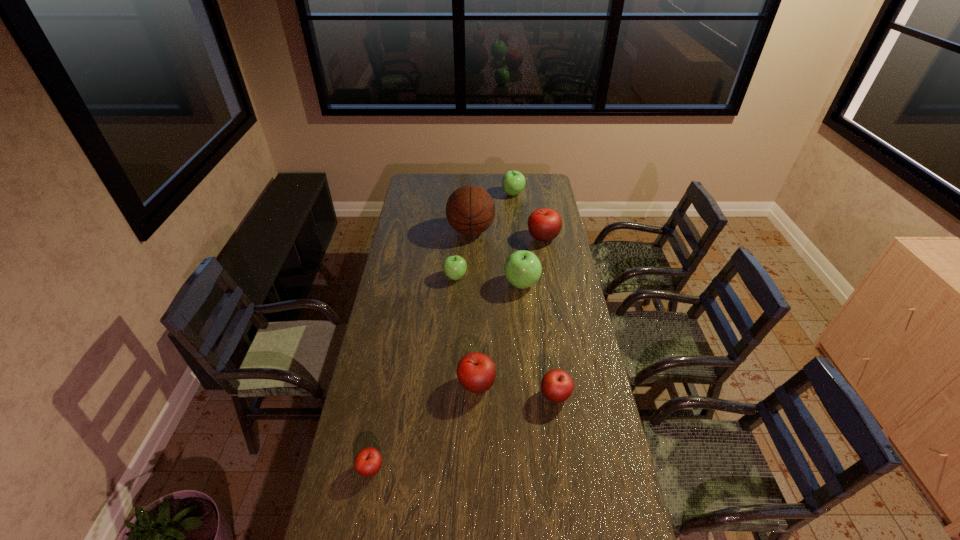
Locate which red apple ranks second in proximity to the biggest green apple. Please provide its 2D coordinates. Your answer should be formatted as a tuple, i.e. [(x, y)], where the tuple contains the x and y coordinates of a point satisfying the conditions above.

[(476, 372)]

Identify the location of the second closest red apple to the basketball. The image size is (960, 540). (476, 372).

You are a GUI agent. You are given a task and a screenshot of the screen. Output one action in this format:
    pyautogui.click(x=<x>, y=<y>)
    Task: Click on the free location that satisfies the following two spatial constraints: 1. on the side with brand label of the second smallest red apple; 2. on the right side of the brown basketball
    The image size is (960, 540).
    Given the screenshot: What is the action you would take?
    pyautogui.click(x=467, y=395)

This screenshot has height=540, width=960. I want to click on vacant point that satisfies the following two spatial constraints: 1. on the side with brand label of the tallest object; 2. on the left side of the biggest green apple, so click(x=469, y=284).